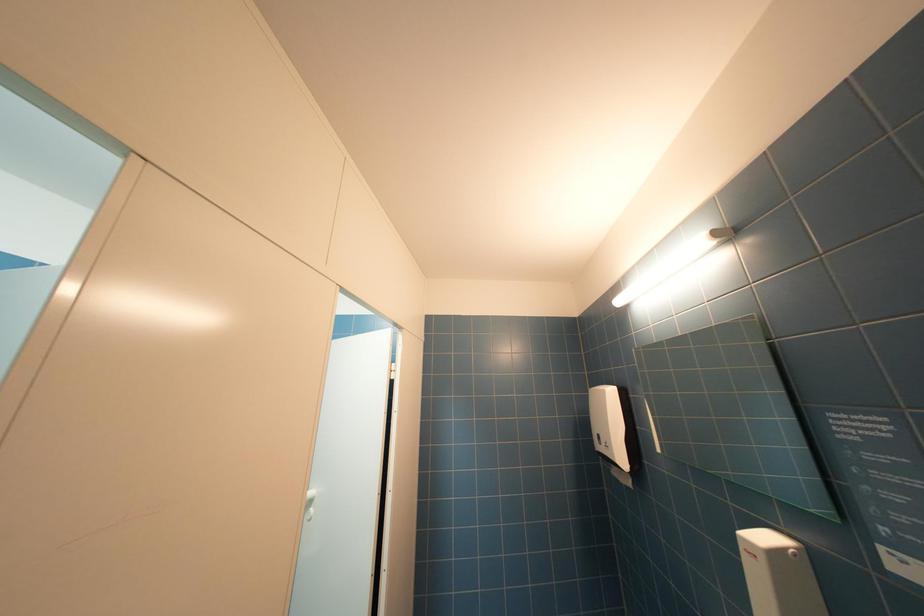
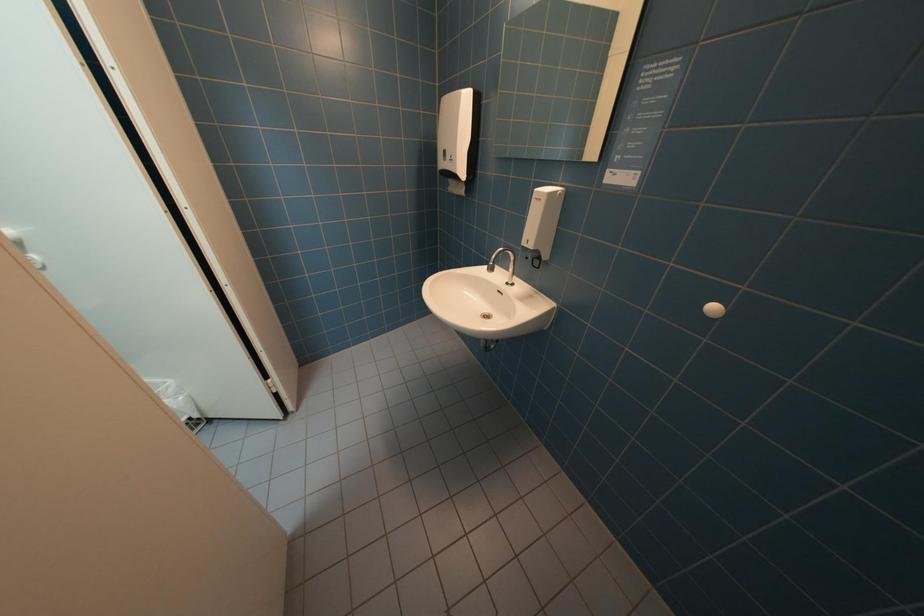
The images are taken continuously from a first-person perspective. In which direction is your viewpoint rotating?

The camera's rotation is toward right-down.